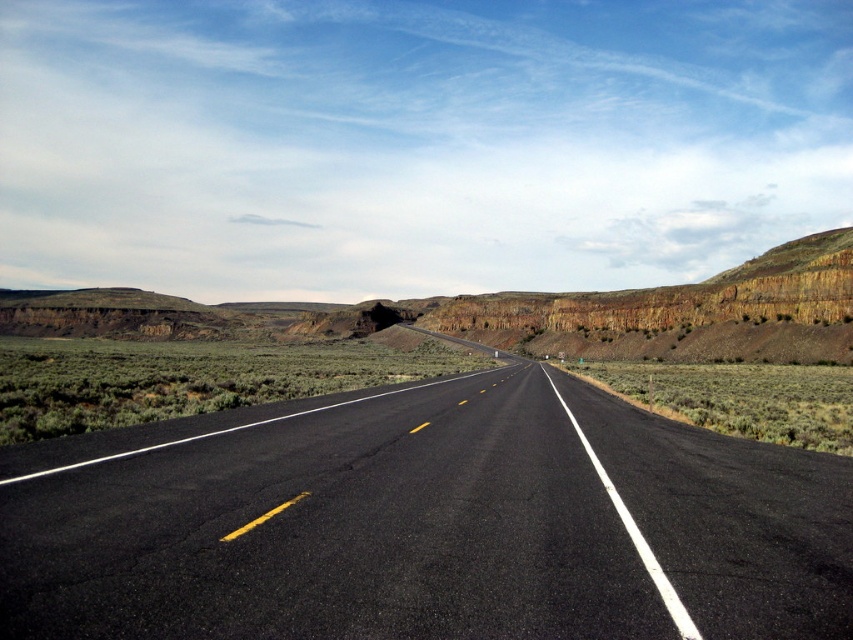
Question: Is black asphalt highway at center above rustic rock formation at center?

Choices:
 (A) yes
 (B) no

Answer: (B)

Question: Is black asphalt highway at center closer to the viewer compared to rustic rock formation at center?

Choices:
 (A) no
 (B) yes

Answer: (B)

Question: Is black asphalt highway at center positioned before rustic rock formation at center?

Choices:
 (A) yes
 (B) no

Answer: (A)